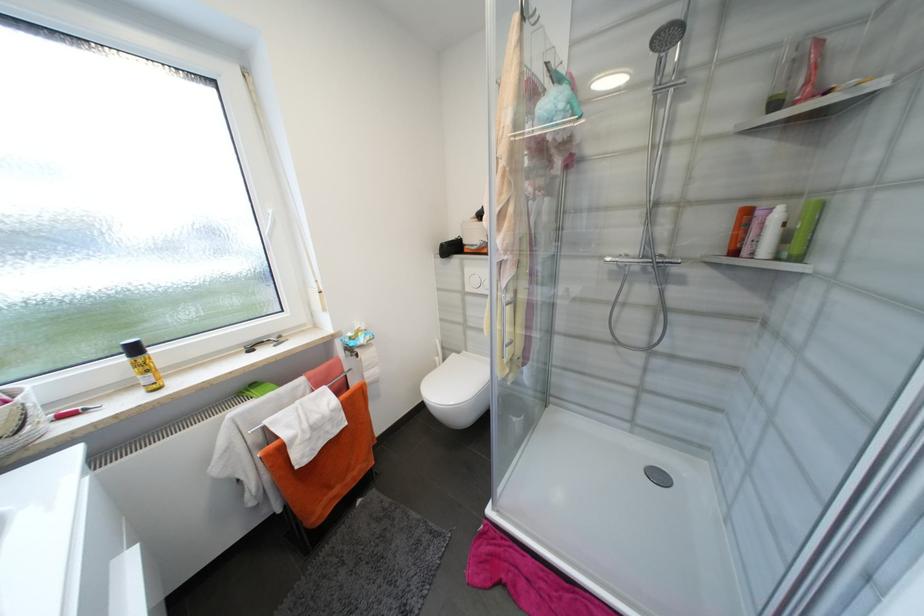
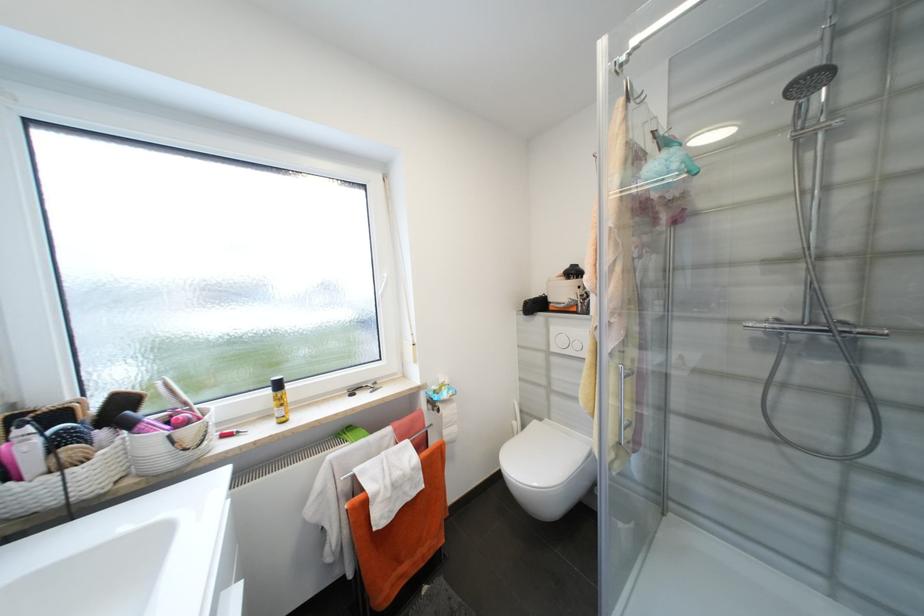
Question: Which direction would the cameraman need to move to produce the second image? Reply with the corresponding letter.

Choices:
 (A) Left
 (B) Right
 (C) Forward
 (D) Backward

Answer: (A)